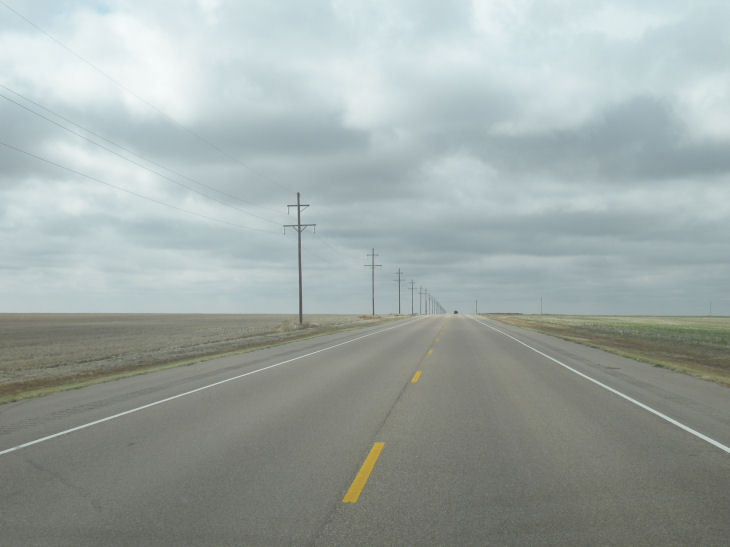
Identify the location of cord. (138, 166).